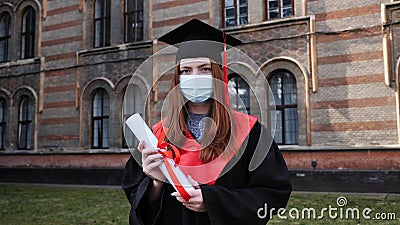
Identify the location of tassel. The height and width of the screenshot is (225, 400). tap(225, 64).